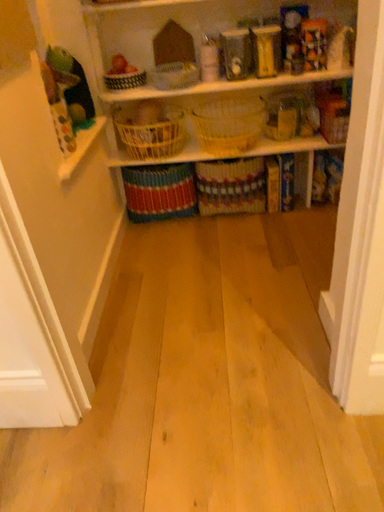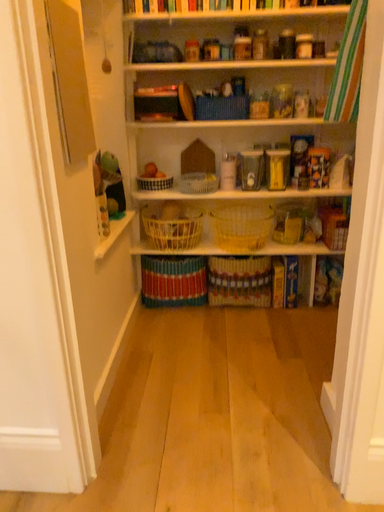
Question: How did the camera likely rotate when shooting the video?

Choices:
 (A) rotated downward
 (B) rotated upward

Answer: (B)